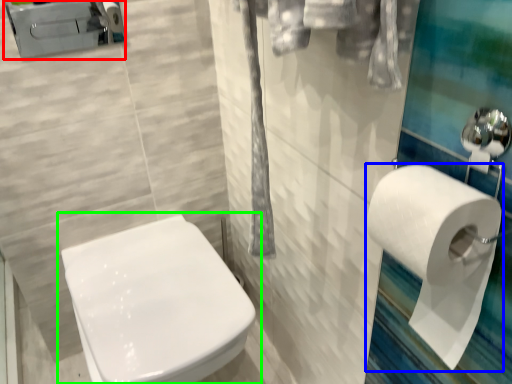
Question: Considering the real-world distances, which object is farthest from porcelain (highlighted by a red box)? toilet paper (highlighted by a blue box) or toilet (highlighted by a green box)?

Choices:
 (A) toilet paper
 (B) toilet

Answer: (A)